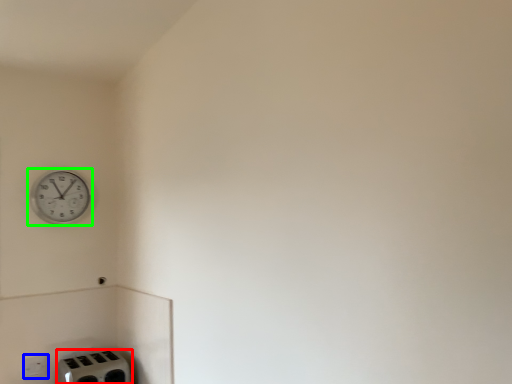
Question: Based on their relative distances, which object is farther from appliance (highlighted by a red box)? Choose from electric outlet (highlighted by a blue box) and wall clock (highlighted by a green box).

Choices:
 (A) electric outlet
 (B) wall clock

Answer: (B)